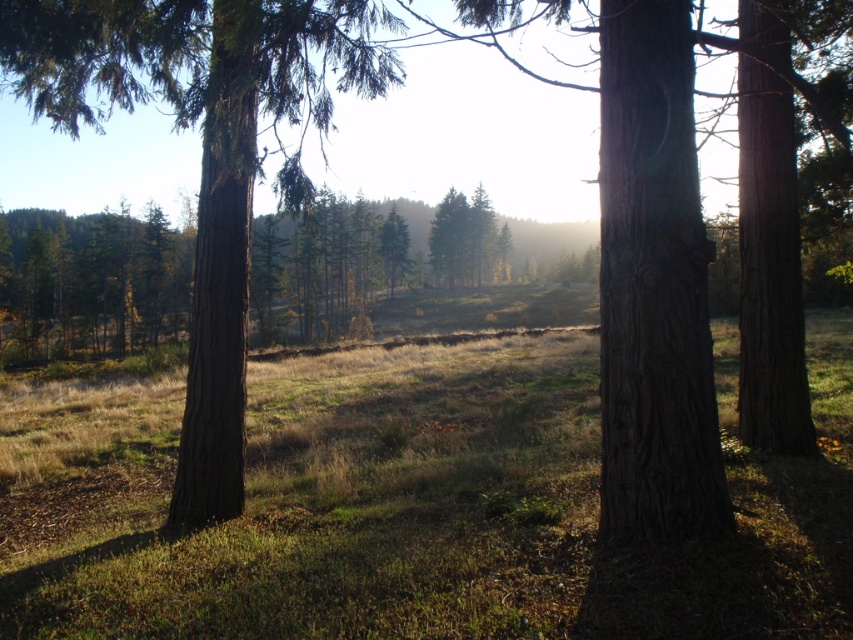
You are a hiker trying to cross the forest. You see the green grassy field at center and the smooth brown tree trunk at center. Which one is wider?

The smooth brown tree trunk at center is wider than the green grassy field at center.

In the scene shown: You are standing in the forest and see two points marked in the scene. Which point is closer to you, point (550, 384) or point (242, 264)?

Point (242, 264) is closer to you because it is less further to the viewer than point 0.600, 0.646.